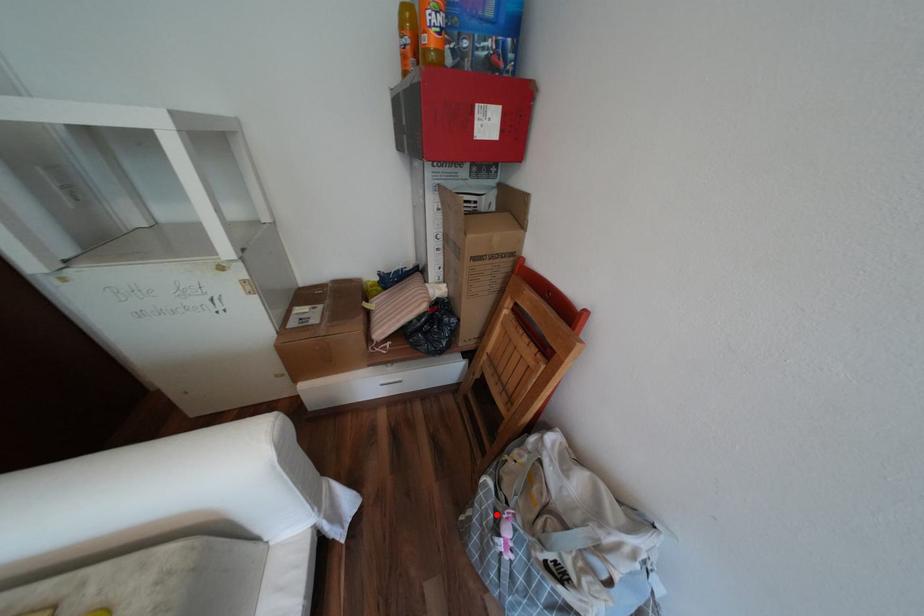
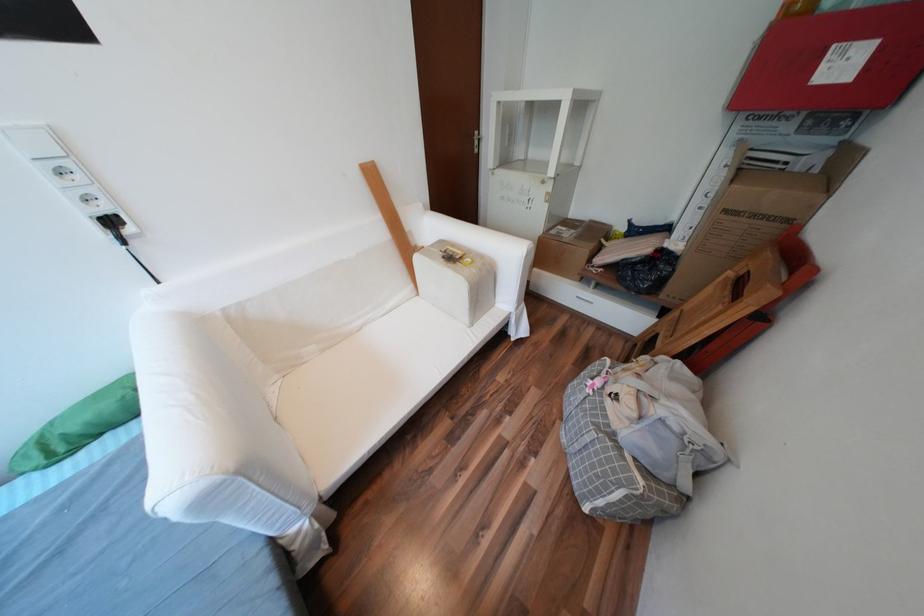
Find the pixel in the second image that matches the highlighted location in the first image.

(602, 371)